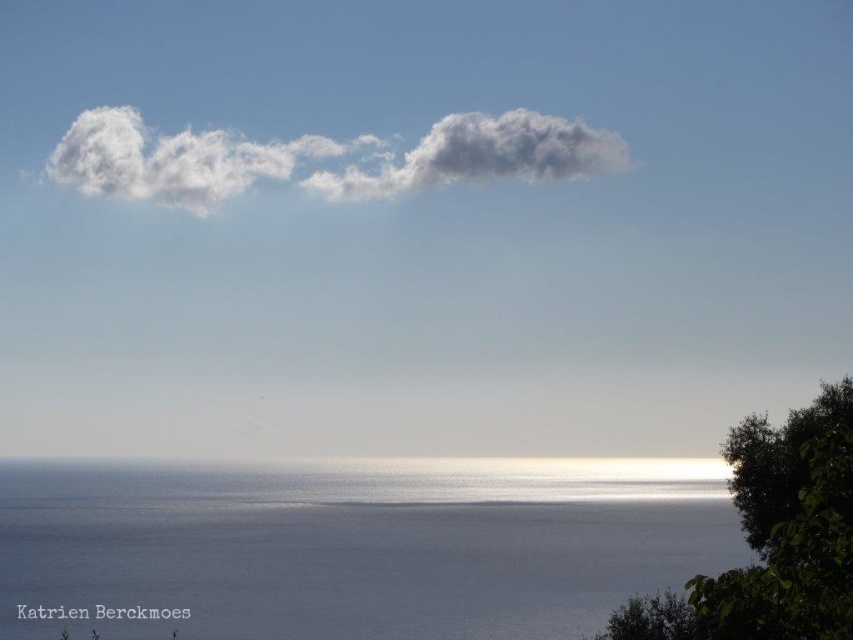
You are standing on the beach and looking at the white fluffy cloud at upper center and the green leafy tree at lower right. Which object is located to the left of the other?

The white fluffy cloud at upper center is positioned on the left side of green leafy tree at lower right.

You are standing on a boat in the middle of the ocean. You see the blue smooth water at lower center and the single elongated cloud in the sky. How far apart are these two objects from your perspective?

The blue smooth water at lower center and the single elongated cloud are 252.02 feet apart.

You are standing at the point marked as point (515, 525) on a map of the seascape. You want to walk to the nearest beach house located 500 meters away from your current position. Can you reach the beach house before sunset if you walk at a speed of 5 km per hour?

The distance between point (515, 525) and the viewer is 328.51 meters. Since the beach house is 500 meters away, it is farther than your current position. Walking at 5 km per hour, it would take approximately 65.7 minutes to reach the beach house. If sunset is within the next hour, you might make it, but this depends on the exact time remaining until sunset.